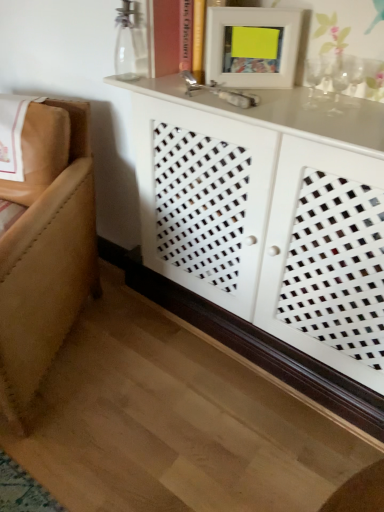
Question: From the image's perspective, does clear glass vase at upper center appear lower than white matte picture frame at upper center?

Choices:
 (A) no
 (B) yes

Answer: (A)

Question: Is clear glass vase at upper center taller than white matte picture frame at upper center?

Choices:
 (A) no
 (B) yes

Answer: (A)

Question: Are clear glass vase at upper center and white matte picture frame at upper center located far from each other?

Choices:
 (A) no
 (B) yes

Answer: (A)

Question: Does clear glass vase at upper center have a lesser height compared to white matte picture frame at upper center?

Choices:
 (A) no
 (B) yes

Answer: (B)

Question: From a real-world perspective, is clear glass vase at upper center positioned under white matte picture frame at upper center based on gravity?

Choices:
 (A) yes
 (B) no

Answer: (A)

Question: Does clear glass vase at upper center turn towards white matte picture frame at upper center?

Choices:
 (A) yes
 (B) no

Answer: (B)

Question: Considering the relative sizes of tan leather couch at left and white lattice cabinet at center in the image provided, is tan leather couch at left thinner than white lattice cabinet at center?

Choices:
 (A) yes
 (B) no

Answer: (B)

Question: Is tan leather couch at left outside white lattice cabinet at center?

Choices:
 (A) yes
 (B) no

Answer: (A)

Question: Is tan leather couch at left smaller than white lattice cabinet at center?

Choices:
 (A) no
 (B) yes

Answer: (B)

Question: Is tan leather couch at left positioned far away from white lattice cabinet at center?

Choices:
 (A) yes
 (B) no

Answer: (B)

Question: From a real-world perspective, is tan leather couch at left on white lattice cabinet at center?

Choices:
 (A) no
 (B) yes

Answer: (A)

Question: Is tan leather couch at left further to the viewer compared to white lattice cabinet at center?

Choices:
 (A) yes
 (B) no

Answer: (A)

Question: Considering the relative sizes of white lattice cabinet at center and clear glass vase at upper center in the image provided, is white lattice cabinet at center shorter than clear glass vase at upper center?

Choices:
 (A) yes
 (B) no

Answer: (B)